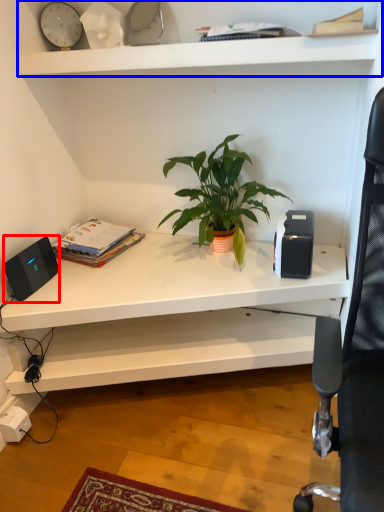
Question: Among these objects, which one is farthest to the camera, speaker (highlighted by a red box) or shelf (highlighted by a blue box)?

Choices:
 (A) speaker
 (B) shelf

Answer: (A)